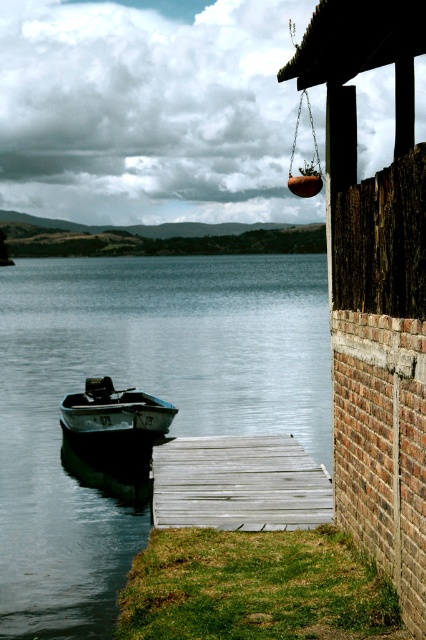
You are standing at the edge of the lakeside scene described. There are two points marked in the image, one at coordinates point (285, 467) and another at point (135, 404). Which of these points is physically closer to your current position?

Point (285, 467) is closer to the camera than point (135, 404), so the point at coordinates point (285, 467) is physically closer to your current position.